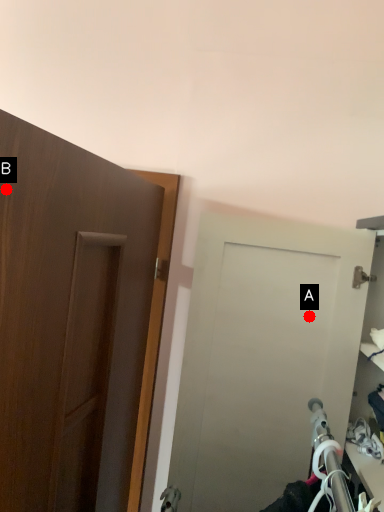
Question: Two points are circled on the image, labeled by A and B beside each circle. Which of the following is the closest to the observer?

Choices:
 (A) A is closer
 (B) B is closer

Answer: (B)